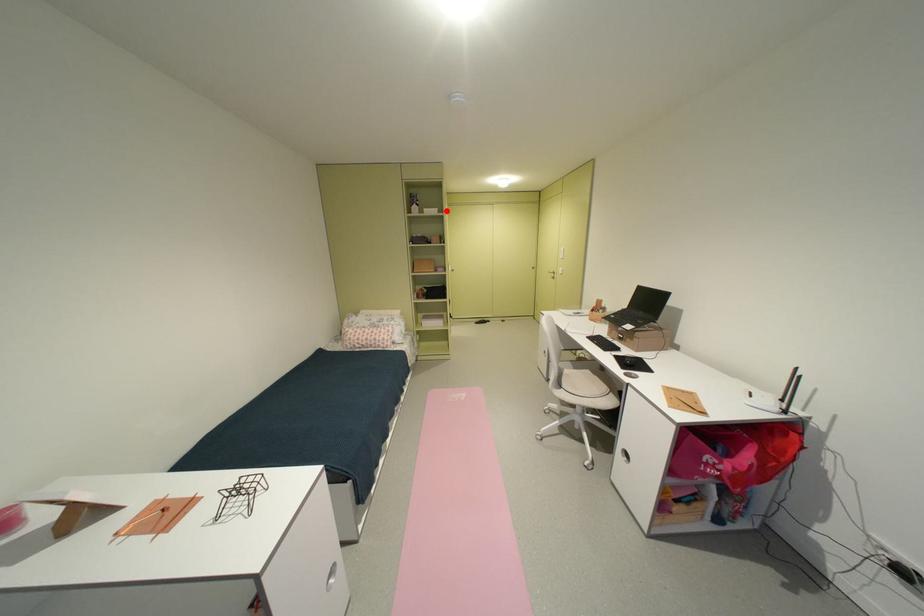
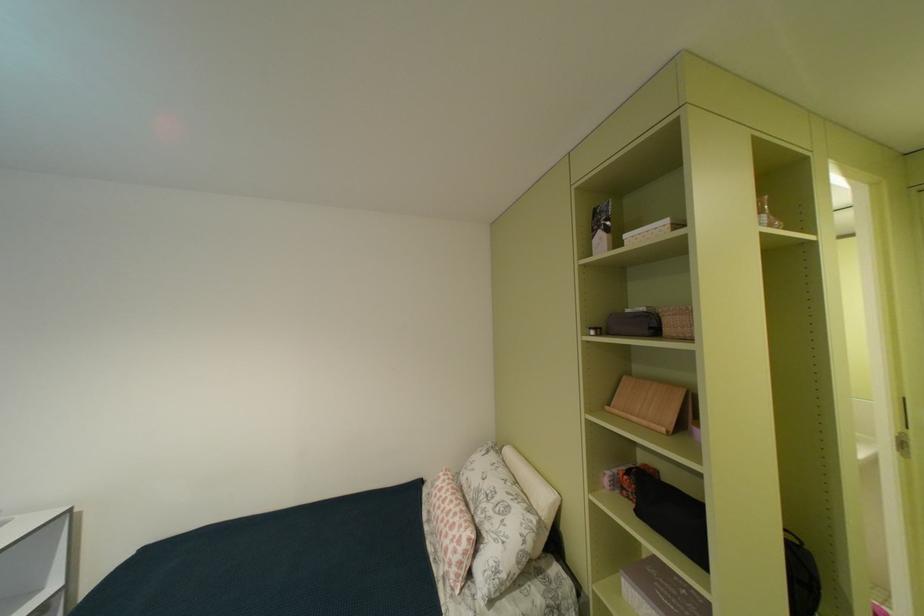
Locate, in the second image, the point that corresponds to the highlighted location in the first image.

(676, 223)